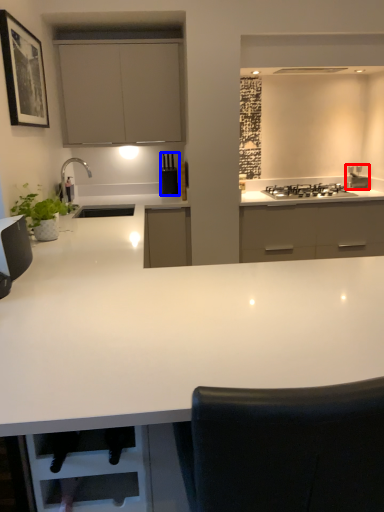
Question: Which of the following is the closest to the observer, appliance (highlighted by a red box) or kitchen appliance (highlighted by a blue box)?

Choices:
 (A) appliance
 (B) kitchen appliance

Answer: (B)